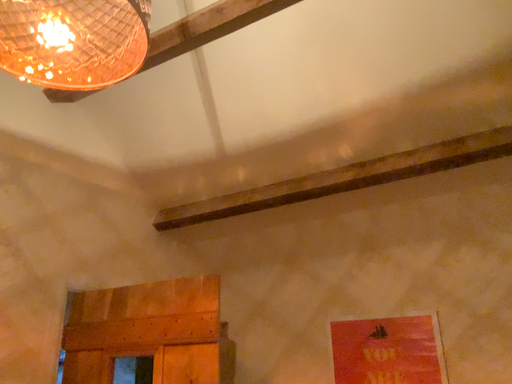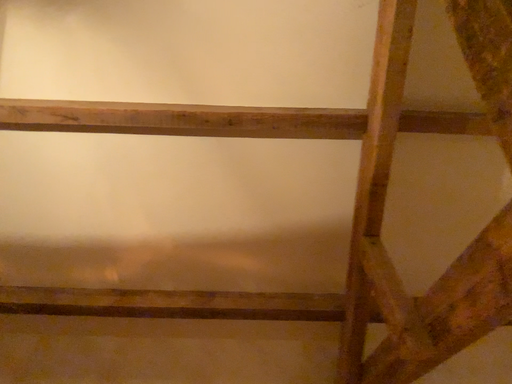
Question: How did the camera likely rotate when shooting the video?

Choices:
 (A) rotated left
 (B) rotated right

Answer: (B)